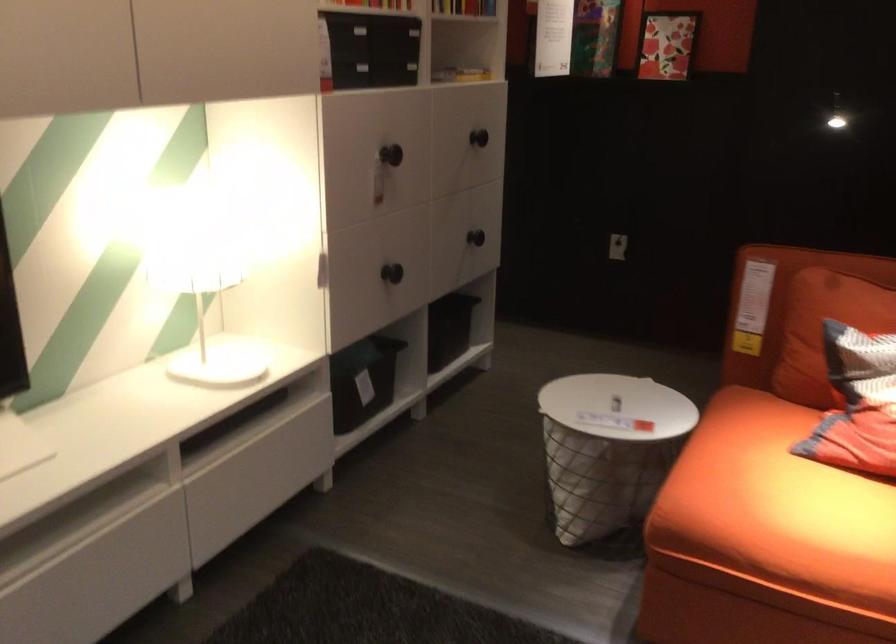
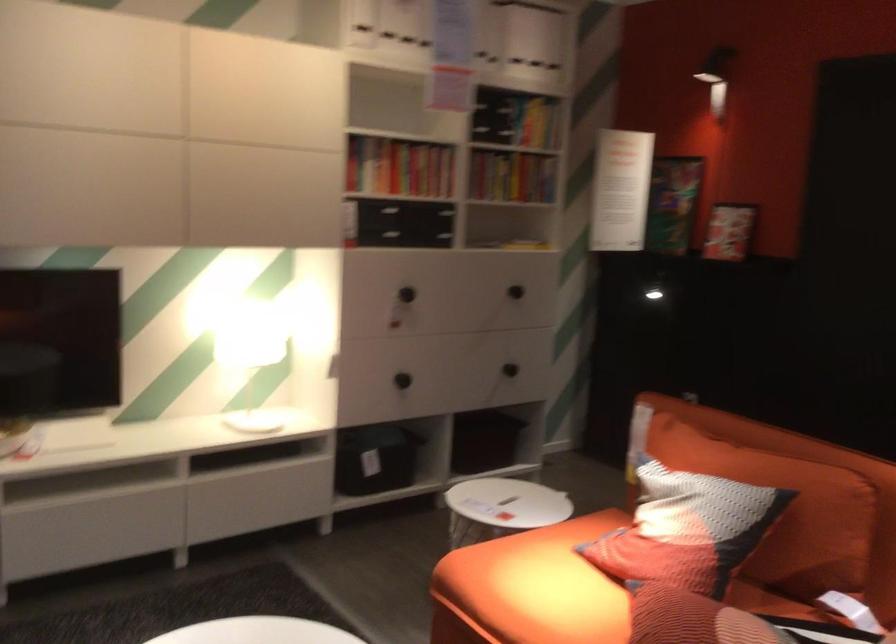
Locate, in the second image, the point that corresponds to the point at 210,277 in the first image.

(250, 354)